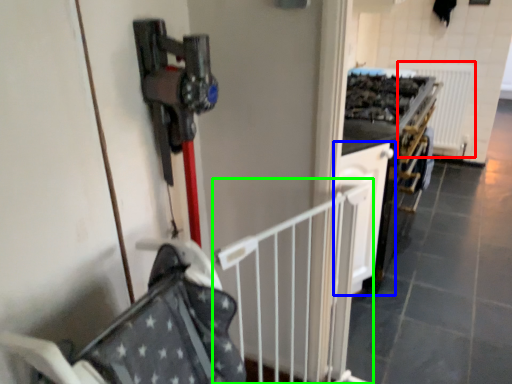
Question: Which object is positioned closest to radiator (highlighted by a red box)? Select from cabinetry (highlighted by a blue box) and rail (highlighted by a green box).

Choices:
 (A) cabinetry
 (B) rail

Answer: (A)